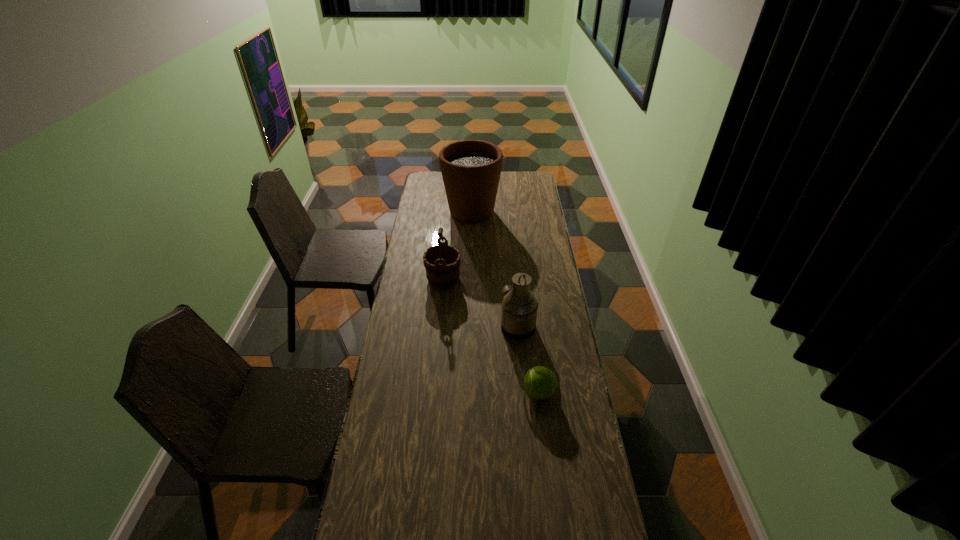
Where is `free spot between the tennis ball and the wine bucket`? free spot between the tennis ball and the wine bucket is located at coordinates (492, 336).

At what (x,y) coordinates should I click in order to perform the action: click on free space between the tennis ball and the second farthest object. Please return your answer as a coordinate pair (x, y). Looking at the image, I should click on (492, 336).

This screenshot has height=540, width=960. What are the coordinates of `vacant region between the wine bucket and the flowerpot` in the screenshot? It's located at (458, 246).

The width and height of the screenshot is (960, 540). I want to click on vacant space in between the nearest object and the third farthest object, so coord(528,360).

At what (x,y) coordinates should I click in order to perform the action: click on unoccupied area between the pitcher and the wine bucket. Please return your answer as a coordinate pair (x, y). Looking at the image, I should click on pos(480,303).

Identify the location of blank region between the farthest object and the second farthest object. This screenshot has height=540, width=960. (458, 246).

Identify the location of object that is the closest to the pitcher. (540, 383).

Select which object appears as the third closest to the second nearest object. Please provide its 2D coordinates. Your answer should be formatted as a tuple, i.e. [(x, y)], where the tuple contains the x and y coordinates of a point satisfying the conditions above.

[(471, 169)]

I want to click on vacant space that satisfies the following two spatial constraints: 1. on the front side of the nearest object; 2. on the left side of the second farthest object, so point(433,393).

Where is `vacant region that satisfies the following two spatial constraints: 1. on the front side of the third nearest object; 2. on the left side of the shortest object`? vacant region that satisfies the following two spatial constraints: 1. on the front side of the third nearest object; 2. on the left side of the shortest object is located at coordinates (433, 393).